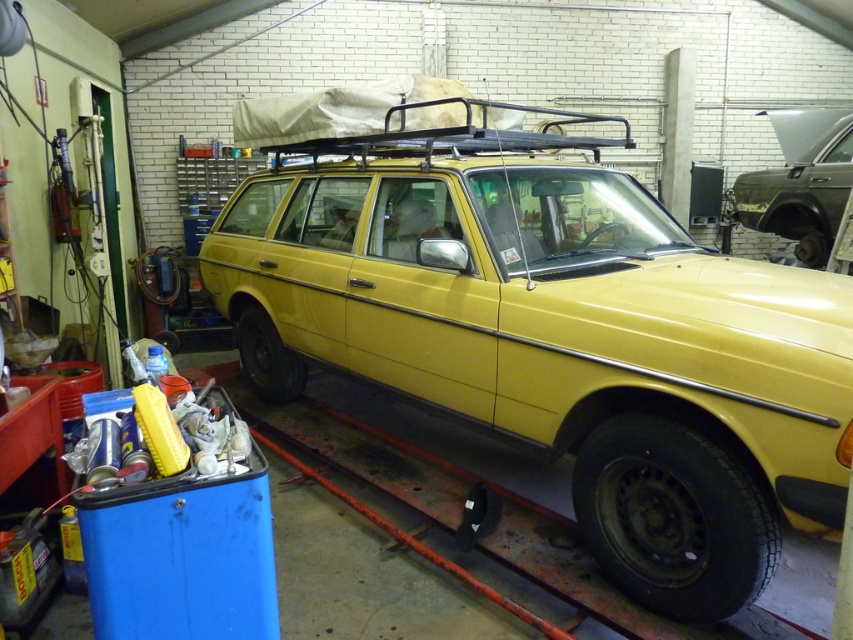
Question: Among these objects, which one is nearest to the camera?

Choices:
 (A) metallic silver car at right
 (B) yellow matte station wagon at center

Answer: (B)

Question: Is yellow matte station wagon at center positioned at the back of metallic silver car at right?

Choices:
 (A) yes
 (B) no

Answer: (B)

Question: Which object is farther from the camera taking this photo?

Choices:
 (A) yellow matte station wagon at center
 (B) metallic silver car at right

Answer: (B)

Question: Does yellow matte station wagon at center appear under metallic silver car at right?

Choices:
 (A) yes
 (B) no

Answer: (A)

Question: Does yellow matte station wagon at center appear under metallic silver car at right?

Choices:
 (A) yes
 (B) no

Answer: (A)